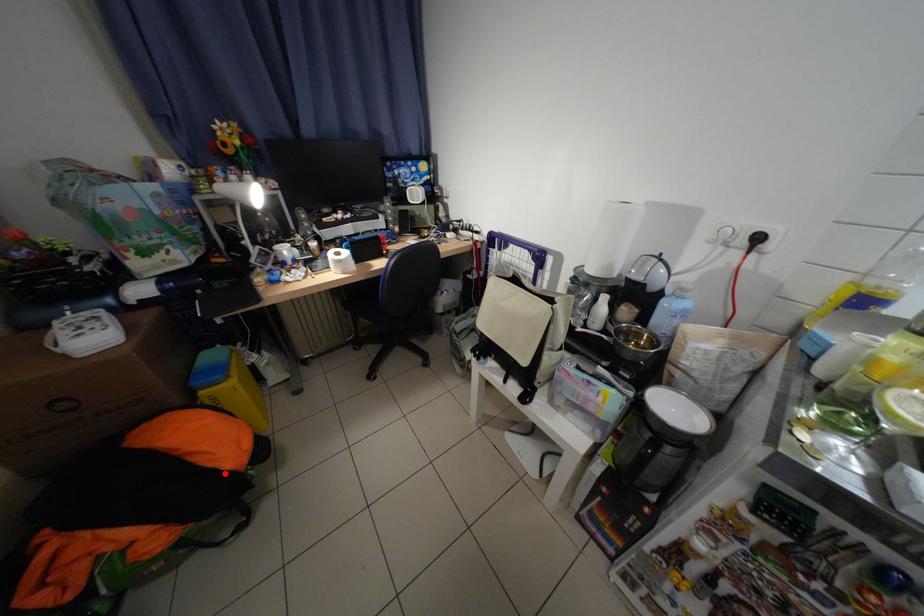
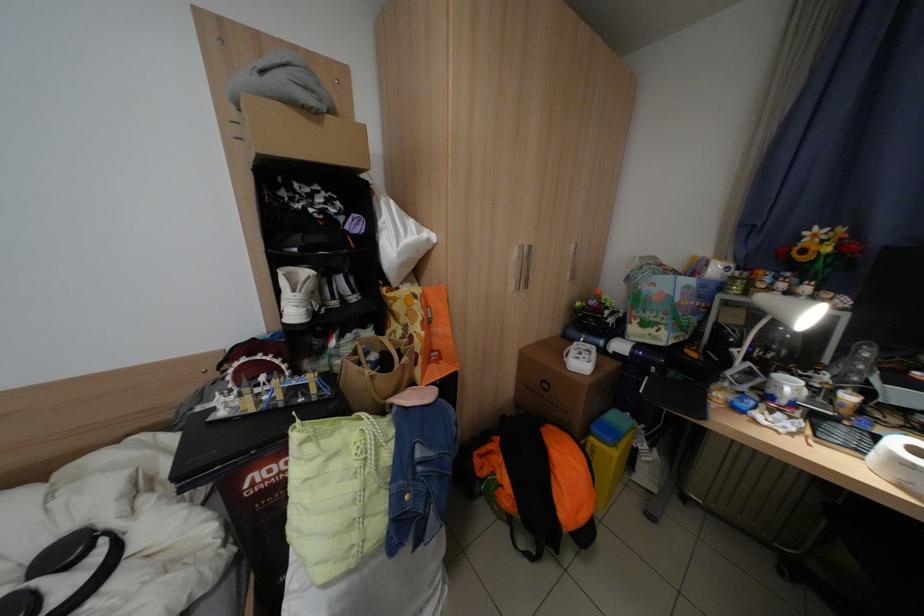
Question: I am providing you with two images of the same scene from different viewpoints. Given a red point in image1, look at the same physical point in image2. Is it:

Choices:
 (A) Closer to the viewpoint
 (B) Farther from the viewpoint

Answer: (B)